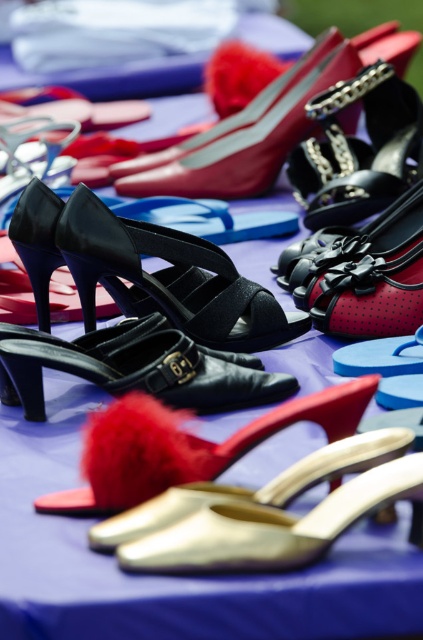
Between velvet black sandal at center and black leather shoe at center, which one has more height?

With more height is velvet black sandal at center.

Is point (176, 259) farther from camera compared to point (173, 385)?

Yes, point (176, 259) is farther from viewer.

Does point (186, 305) come in front of point (164, 348)?

No, it is not.

Locate an element on the screen. Image resolution: width=423 pixels, height=640 pixels. velvet black sandal at center is located at coordinates (169, 278).

Who is taller, gold metallic sandal at lower center or black leather shoe at center?

With more height is black leather shoe at center.

Does gold metallic sandal at lower center have a larger size compared to black leather shoe at center?

No, gold metallic sandal at lower center is not bigger than black leather shoe at center.

Identify the location of gold metallic sandal at lower center. (280, 515).

Which is above, gold metallic sandal at lower center or shiny leather high-heeled shoe at upper center?

shiny leather high-heeled shoe at upper center is higher up.

Is gold metallic sandal at lower center thinner than shiny leather high-heeled shoe at upper center?

Yes.

You are a GUI agent. You are given a task and a screenshot of the screen. Output one action in this format:
    pyautogui.click(x=<x>, y=<y>)
    Task: Click on the gold metallic sandal at lower center
    Image resolution: width=423 pixels, height=640 pixels.
    Given the screenshot: What is the action you would take?
    pyautogui.click(x=280, y=515)

At what (x,y) coordinates should I click in order to perform the action: click on gold metallic sandal at lower center. Please return your answer as a coordinate pair (x, y). Looking at the image, I should click on (280, 515).